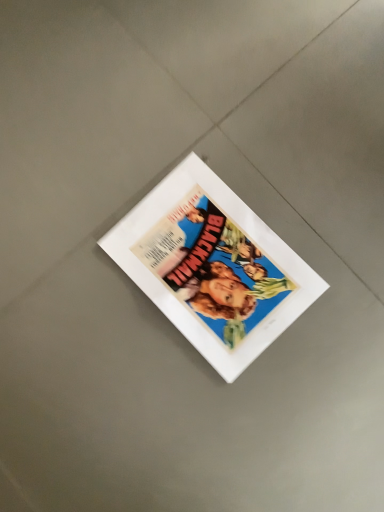
The height and width of the screenshot is (512, 384). What do you see at coordinates (212, 267) in the screenshot? I see `matte white magazine at center` at bounding box center [212, 267].

In order to face matte white magazine at center, should I rotate leftwards or rightwards?

You should rotate right by 4.514 degrees.

Find the location of a particular element. The height and width of the screenshot is (512, 384). matte white magazine at center is located at coordinates click(212, 267).

Where is `matte white magazine at center`? matte white magazine at center is located at coordinates (212, 267).